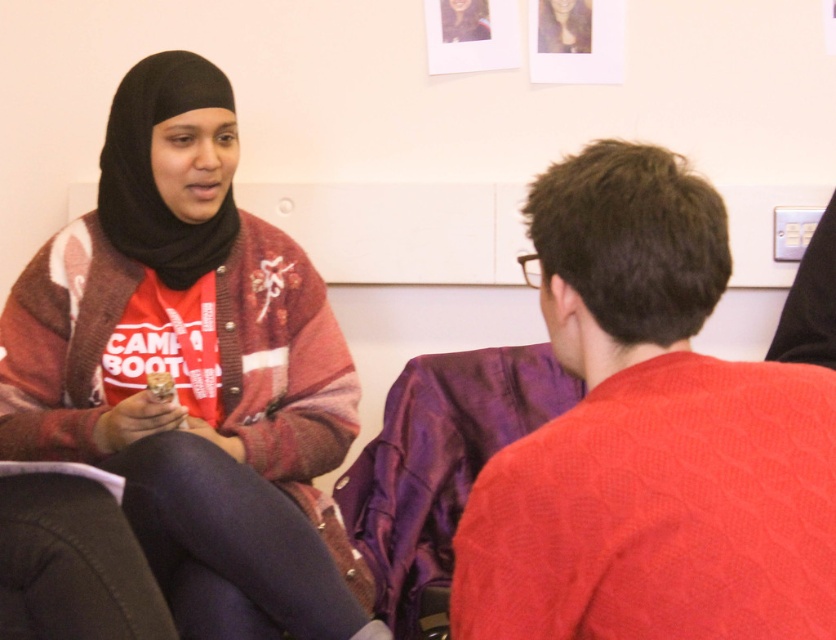
You are a fashion designer observing the two individuals in the image. You need to determine which item of clothing is taller between the matte red cardigan at left and the matte black hijab at upper left. Based on the scene, which one is taller?

The matte red cardigan at left is much taller than the matte black hijab at upper left.

In the scene shown: You are standing in the room and want to reach both points. Which point, point [131,214] or point [149,385], will you reach first if you move straight towards them?

Point [131,214] is further to the camera than point [149,385], so you will reach point [149,385] first because it is closer to you.